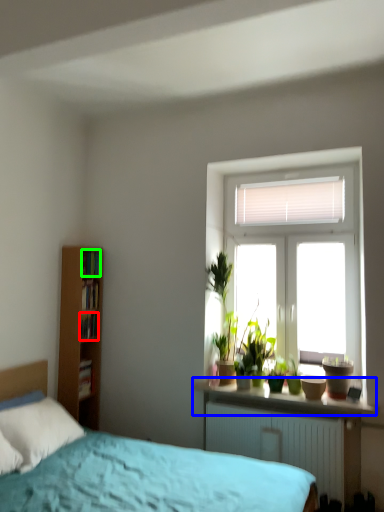
Question: Which object is positioned farthest from book (highlighted by a red box)? Select from window sill (highlighted by a blue box) and book (highlighted by a green box).

Choices:
 (A) window sill
 (B) book

Answer: (A)